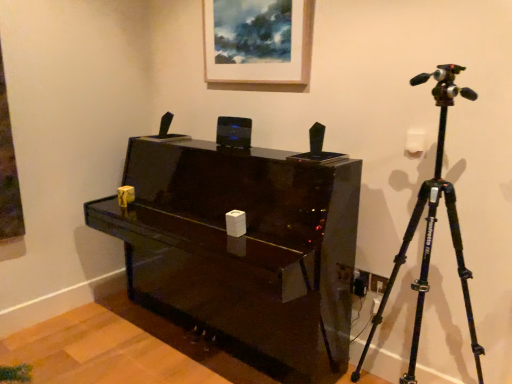
Question: From a real-world perspective, is black matte tripod at right located beneath wooden picture frame at upper center?

Choices:
 (A) no
 (B) yes

Answer: (B)

Question: Does black matte tripod at right have a lesser height compared to wooden picture frame at upper center?

Choices:
 (A) yes
 (B) no

Answer: (B)

Question: Can you confirm if black matte tripod at right is positioned to the left of wooden picture frame at upper center?

Choices:
 (A) no
 (B) yes

Answer: (A)

Question: From the image's perspective, does black matte tripod at right appear lower than wooden picture frame at upper center?

Choices:
 (A) no
 (B) yes

Answer: (B)

Question: Would you say wooden picture frame at upper center is part of black matte tripod at right's contents?

Choices:
 (A) yes
 (B) no

Answer: (B)

Question: Does black matte tripod at right turn towards wooden picture frame at upper center?

Choices:
 (A) no
 (B) yes

Answer: (A)

Question: Is glossy black piano at center to the left of black matte tripod at right from the viewer's perspective?

Choices:
 (A) no
 (B) yes

Answer: (B)

Question: From a real-world perspective, is glossy black piano at center located higher than black matte tripod at right?

Choices:
 (A) yes
 (B) no

Answer: (B)

Question: Can you see glossy black piano at center touching black matte tripod at right?

Choices:
 (A) no
 (B) yes

Answer: (A)

Question: Does glossy black piano at center come in front of black matte tripod at right?

Choices:
 (A) no
 (B) yes

Answer: (A)

Question: Would you say black matte tripod at right is part of glossy black piano at center's contents?

Choices:
 (A) no
 (B) yes

Answer: (A)

Question: From the image's perspective, would you say glossy black piano at center is positioned over black matte tripod at right?

Choices:
 (A) yes
 (B) no

Answer: (B)

Question: Can you confirm if glossy black piano at center is smaller than wooden picture frame at upper center?

Choices:
 (A) yes
 (B) no

Answer: (B)